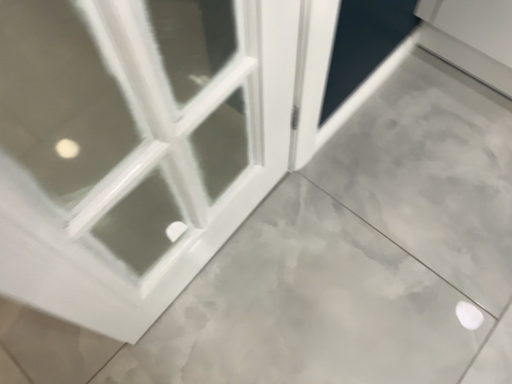
Question: Is white glossy door at upper left a part of white glossy screen door at upper right?

Choices:
 (A) yes
 (B) no

Answer: (B)

Question: Can you confirm if white glossy screen door at upper right is taller than white glossy door at upper left?

Choices:
 (A) yes
 (B) no

Answer: (A)

Question: Is white glossy door at upper left at the back of white glossy screen door at upper right?

Choices:
 (A) no
 (B) yes

Answer: (B)

Question: Can you confirm if white glossy screen door at upper right is positioned to the right of white glossy door at upper left?

Choices:
 (A) no
 (B) yes

Answer: (B)

Question: Is white glossy screen door at upper right thinner than white glossy door at upper left?

Choices:
 (A) yes
 (B) no

Answer: (A)

Question: Does white glossy screen door at upper right have a smaller size compared to white glossy door at upper left?

Choices:
 (A) no
 (B) yes

Answer: (B)

Question: From a real-world perspective, is white glossy door at upper left located higher than white glossy screen door at upper right?

Choices:
 (A) no
 (B) yes

Answer: (A)

Question: Is white glossy door at upper left thinner than white glossy screen door at upper right?

Choices:
 (A) no
 (B) yes

Answer: (A)

Question: Is white glossy door at upper left touching white glossy screen door at upper right?

Choices:
 (A) no
 (B) yes

Answer: (A)

Question: Is the depth of white glossy door at upper left greater than that of white glossy screen door at upper right?

Choices:
 (A) no
 (B) yes

Answer: (A)

Question: Does white glossy door at upper left have a lesser height compared to white glossy screen door at upper right?

Choices:
 (A) yes
 (B) no

Answer: (A)

Question: Considering the relative positions of white glossy door at upper left and white glossy screen door at upper right in the image provided, is white glossy door at upper left to the left of white glossy screen door at upper right from the viewer's perspective?

Choices:
 (A) no
 (B) yes

Answer: (B)

Question: Does point (323, 16) appear closer or farther from the camera than point (155, 238)?

Choices:
 (A) closer
 (B) farther

Answer: (A)